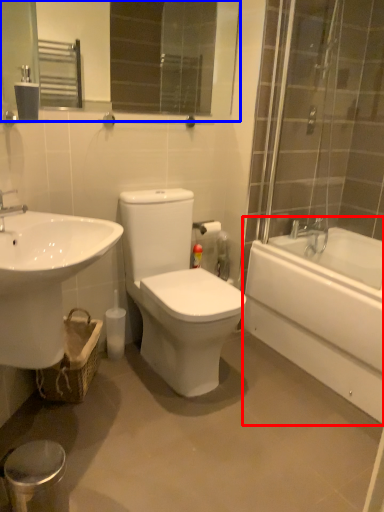
Question: Which object appears farthest to the camera in this image, bathtub (highlighted by a red box) or mirror (highlighted by a blue box)?

Choices:
 (A) bathtub
 (B) mirror

Answer: (A)